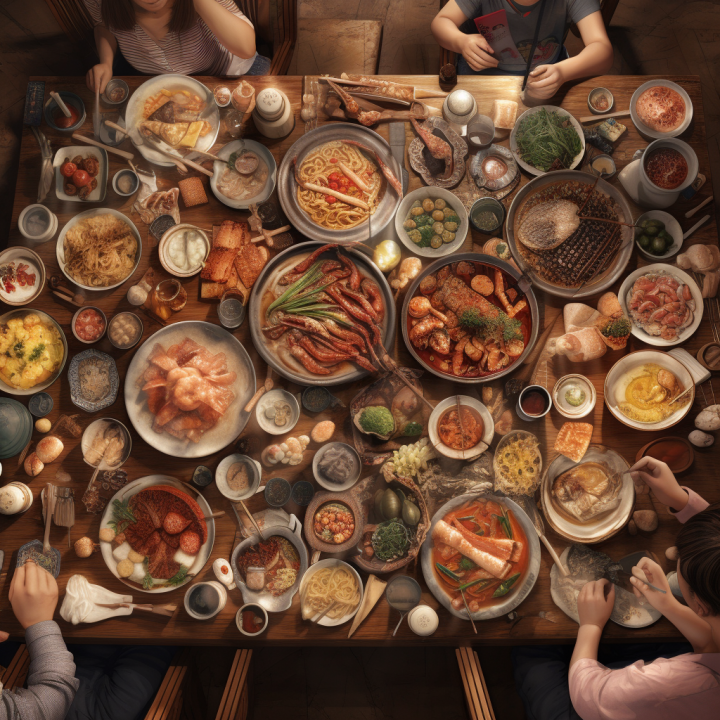
The image size is (720, 720). Find the location of `table`. table is located at coordinates (160, 631), (140, 472), (289, 85), (477, 91).